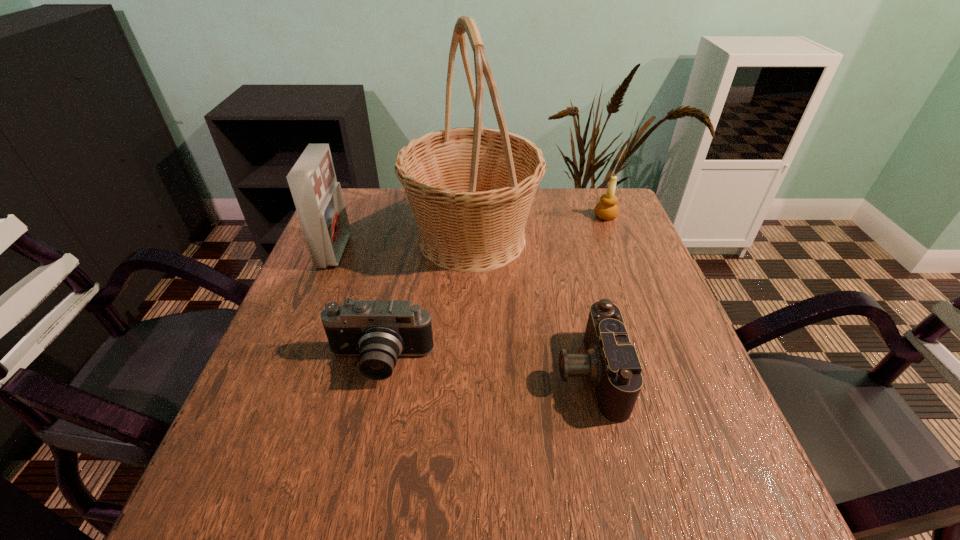
Where is `basket`? This screenshot has width=960, height=540. basket is located at coordinates (470, 189).

Where is `the first-aid kit`? The width and height of the screenshot is (960, 540). the first-aid kit is located at coordinates (318, 198).

Identify the location of the fourth shortest object. The height and width of the screenshot is (540, 960). (318, 198).

Identify the location of candle_holder. (607, 209).

What are the coordinates of `the left camera` in the screenshot? It's located at (378, 332).

This screenshot has width=960, height=540. I want to click on the right camera, so click(x=611, y=364).

Find the location of a particular element. Image resolution: width=960 pixels, height=540 pixels. the shortest object is located at coordinates (611, 364).

At what (x,y) coordinates should I click in order to perform the action: click on blank space located 0.190m on the right of the basket. Please return your answer as a coordinate pair (x, y). Looking at the image, I should click on (609, 238).

Find the location of a particular element. This screenshot has width=960, height=540. free space located on the front-facing side of the leftmost object is located at coordinates (492, 251).

I want to click on vacant region located on the front of the rightmost object, so click(x=643, y=313).